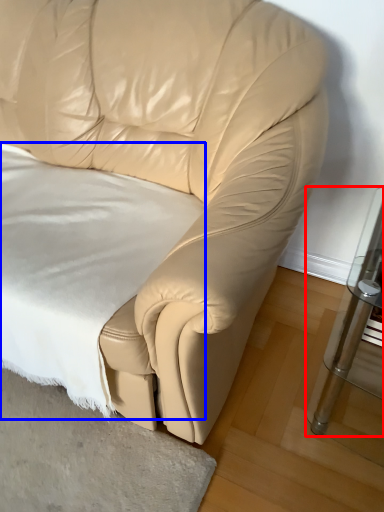
Question: Which point is further to the camera, table (highlighted by a red box) or sheet (highlighted by a blue box)?

Choices:
 (A) table
 (B) sheet

Answer: (B)